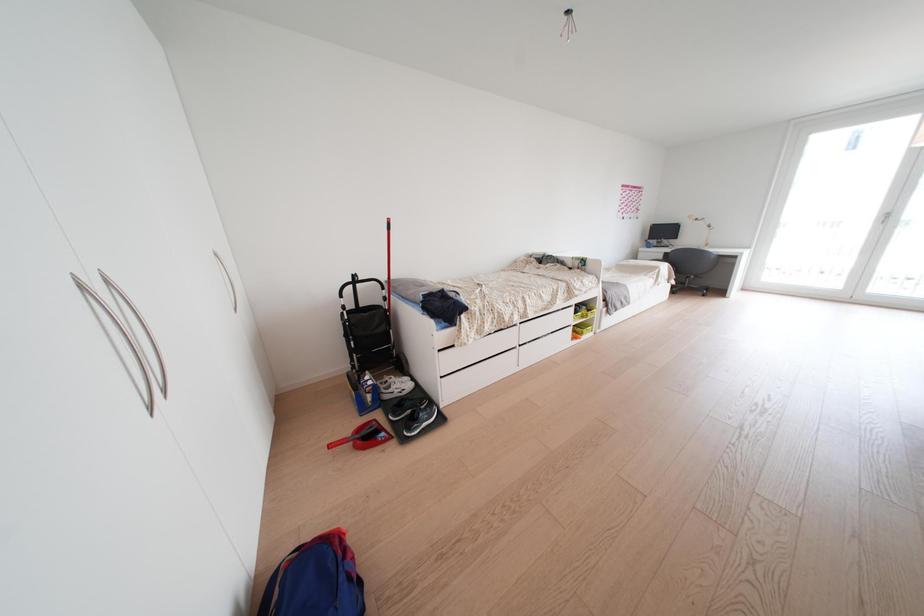
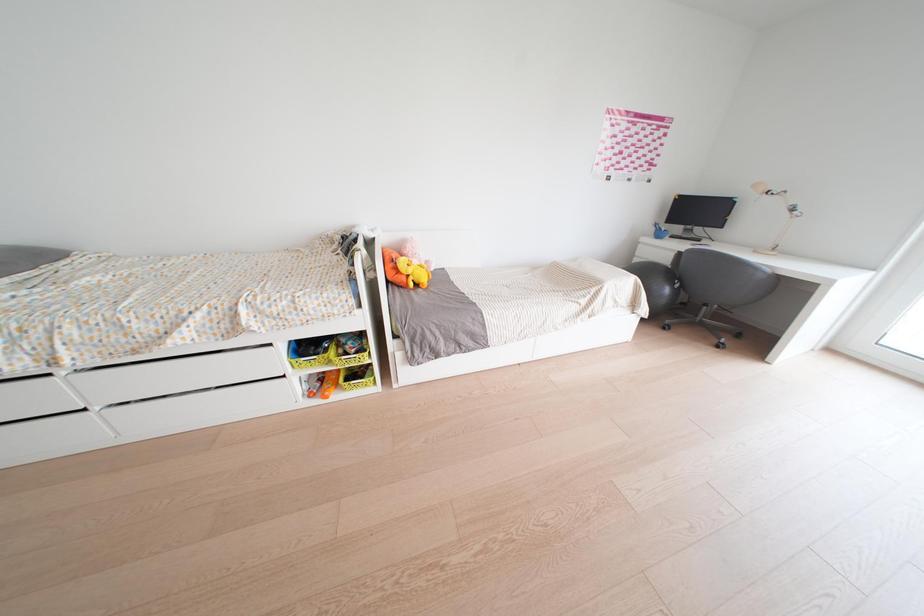
In a continuous first-person perspective shot, in which direction is the camera moving?

The cameraman walked toward right, forward.